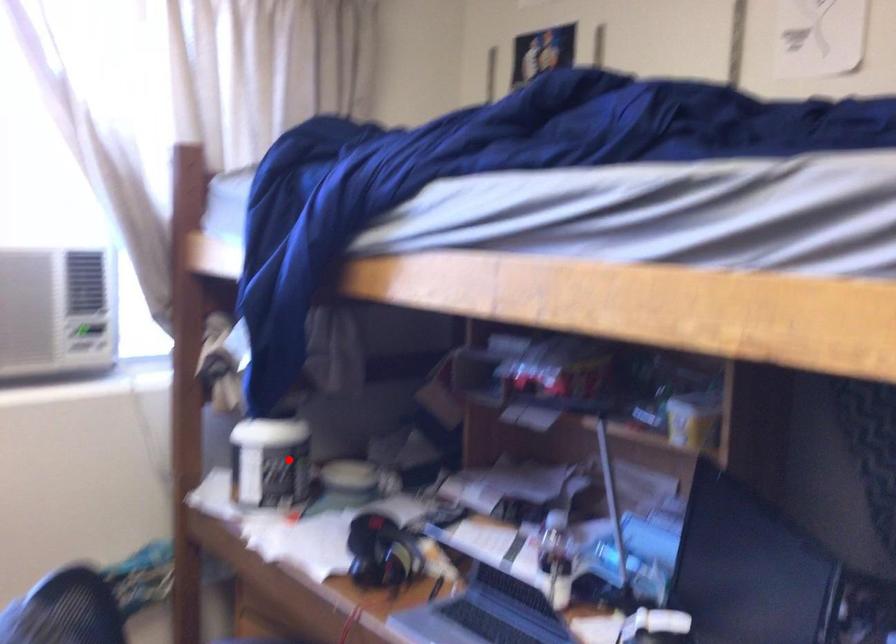
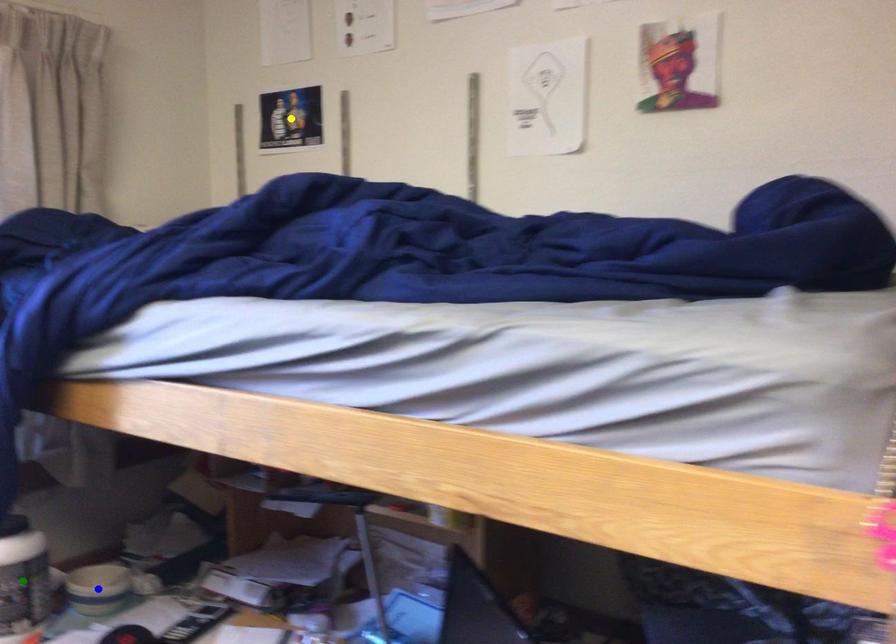
Question: I am providing you with two images of the same scene from different viewpoints. A red point is marked on the first image. You are given multiple points on the second image. Which spot in image 2 lines up with the point in image 1?

Choices:
 (A) blue point
 (B) yellow point
 (C) green point

Answer: (C)